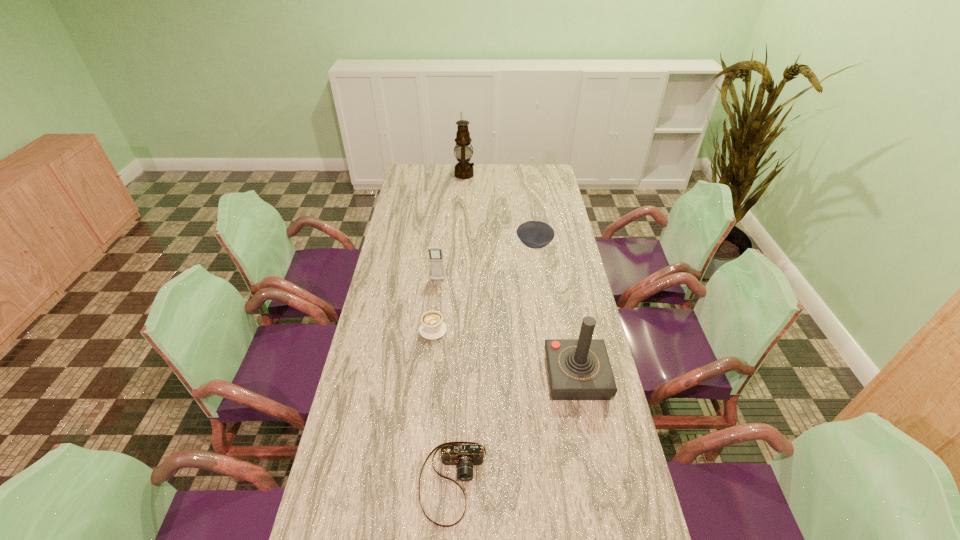
You are a GUI agent. You are given a task and a screenshot of the screen. Output one action in this format:
    pyautogui.click(x=<x>, y=<y>)
    Task: Click on the free location located on the rectangular base of the fifth shortest object
    
    Given the screenshot: What is the action you would take?
    pyautogui.click(x=585, y=418)

This screenshot has height=540, width=960. I want to click on vacant point located on the front-facing side of the third farthest object, so click(434, 313).

Locate an element on the screen. This screenshot has width=960, height=540. free space located 0.080m on the front of the second farthest object is located at coordinates (538, 269).

The height and width of the screenshot is (540, 960). In order to click on vacant position located 0.200m to the right of the fourth farthest object's handle in this screenshot , I will do `click(438, 281)`.

This screenshot has width=960, height=540. Identify the location of free spot located to the right of the fourth farthest object's handle. (439, 279).

Identify the location of free spot located to the right of the fourth farthest object's handle. (439, 276).

The width and height of the screenshot is (960, 540). What are the coordinates of `object at the far edge` in the screenshot? It's located at (463, 169).

Find the location of `joystick situated at the right edge`. joystick situated at the right edge is located at coordinates (579, 369).

At what (x,y) coordinates should I click in order to perform the action: click on bowl located at the right edge. Please return your answer as a coordinate pair (x, y). Looking at the image, I should click on (534, 234).

Locate an element on the screen. The width and height of the screenshot is (960, 540). free space at the left edge of the desktop is located at coordinates (390, 282).